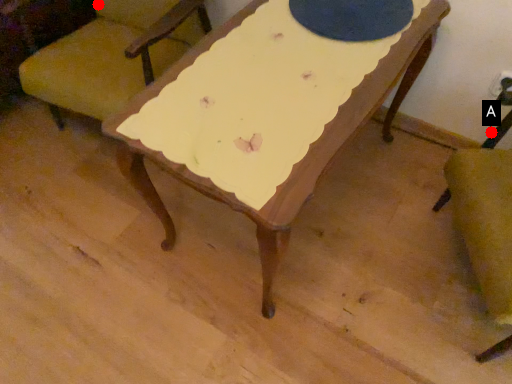
Question: Two points are circled on the image, labeled by A and B beside each circle. Which point appears farthest from the camera in this image?

Choices:
 (A) A is further
 (B) B is further

Answer: (B)